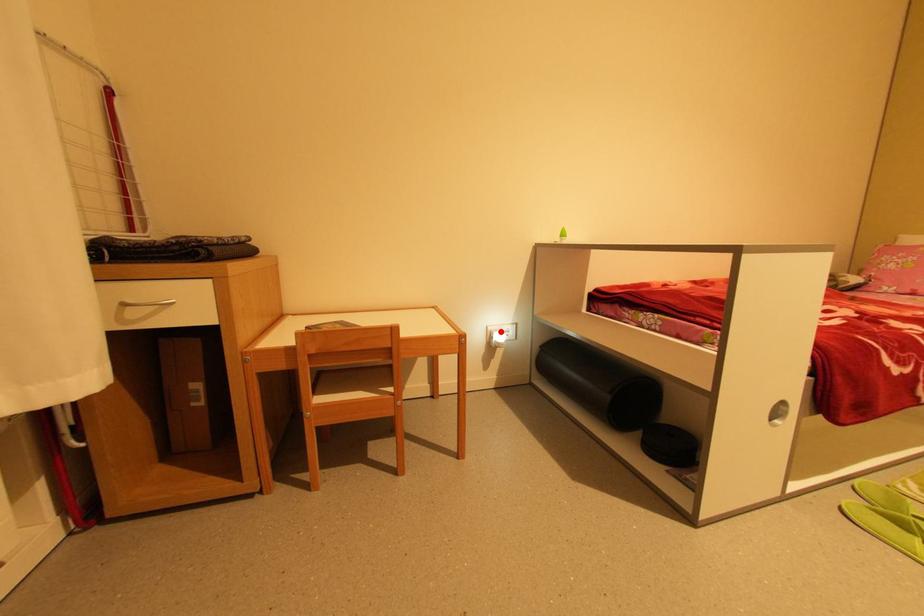
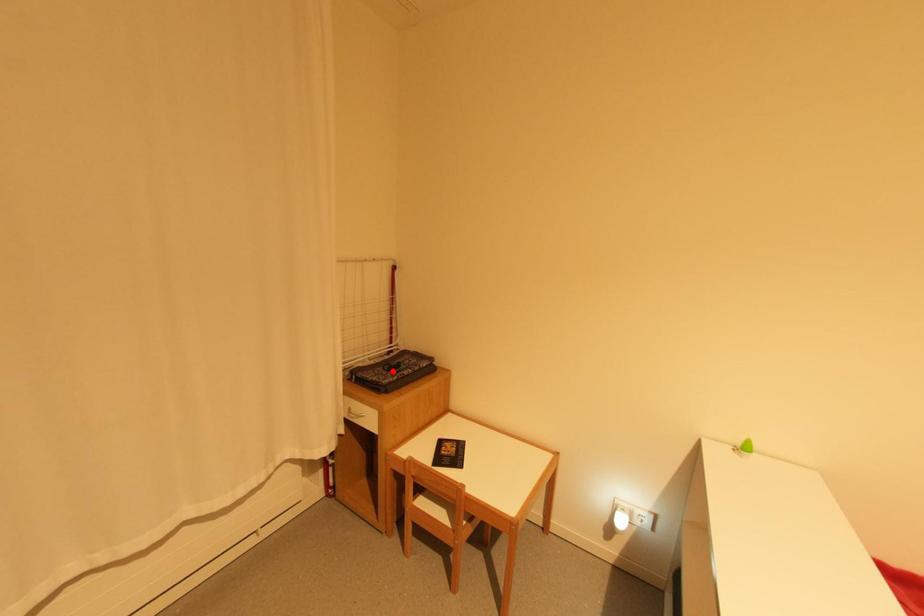
I am providing you with two images of the same scene from different viewpoints. A red point is marked on the first image and another point is marked on the second image. Is the marked point in image1 the same physical position as the marked point in image2?

No